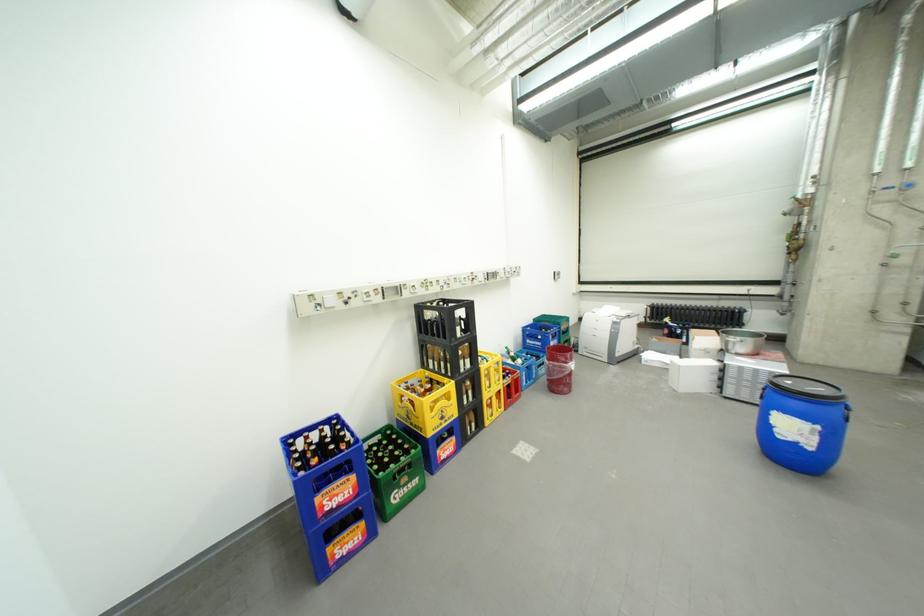
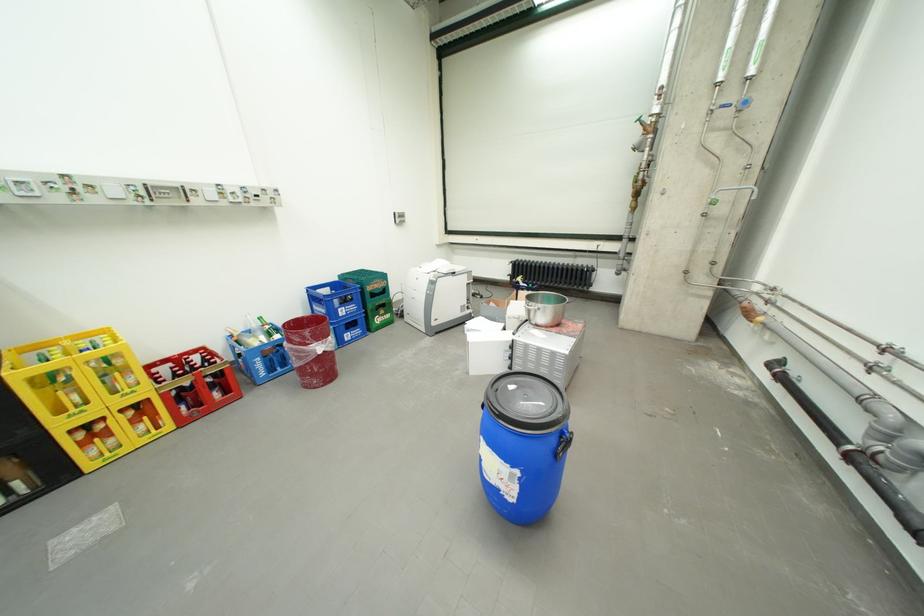
Find the pixel in the second image that matches point 737,339 in the first image.

(540, 304)